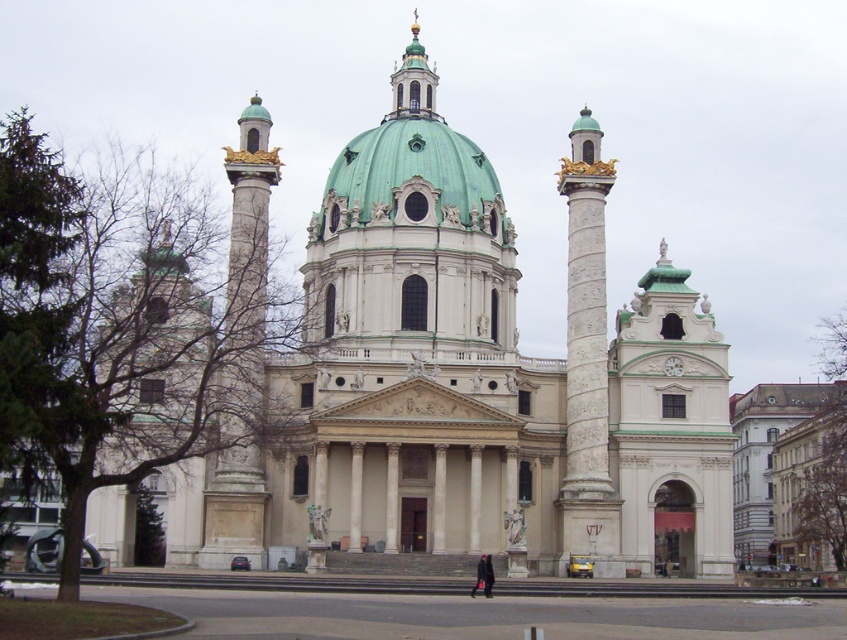
Does white stone church at center appear over white marble column at right?

Yes, white stone church at center is above white marble column at right.

Can you confirm if white stone church at center is bigger than white marble column at right?

Correct, white stone church at center is larger in size than white marble column at right.

Who is more forward, (x=464, y=515) or (x=596, y=509)?

Point (x=596, y=509) is in front.

Where is `white stone church at center`? The height and width of the screenshot is (640, 847). white stone church at center is located at coordinates (472, 381).

Describe the element at coordinates (587, 356) in the screenshot. I see `white marble column at right` at that location.

Does white marble column at right appear on the right side of green matte dome at center?

Indeed, white marble column at right is positioned on the right side of green matte dome at center.

Describe the element at coordinates (587, 356) in the screenshot. The image size is (847, 640). I see `white marble column at right` at that location.

You are a GUI agent. You are given a task and a screenshot of the screen. Output one action in this format:
    pyautogui.click(x=<x>, y=<y>)
    Task: Click on the white marble column at right
    Image resolution: width=847 pixels, height=640 pixels.
    Given the screenshot: What is the action you would take?
    pyautogui.click(x=587, y=356)

Between white stone church at center and green matte dome at center, which one has less height?

green matte dome at center is shorter.

Is white stone church at center in front of green matte dome at center?

Yes.

Is point (656, 410) closer to camera compared to point (435, 180)?

Yes.

Locate an element on the screen. This screenshot has height=640, width=847. white stone church at center is located at coordinates (472, 381).